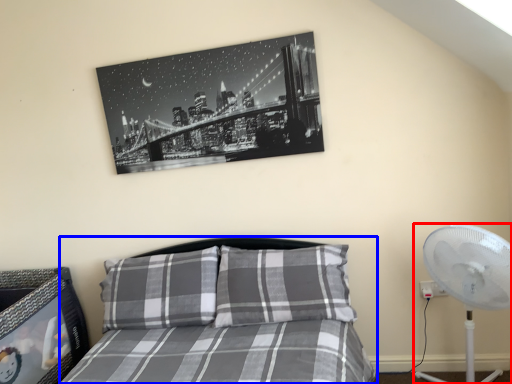
Question: Which point is closer to the camera, mechanical fan (highlighted by a red box) or bed (highlighted by a blue box)?

Choices:
 (A) mechanical fan
 (B) bed

Answer: (B)